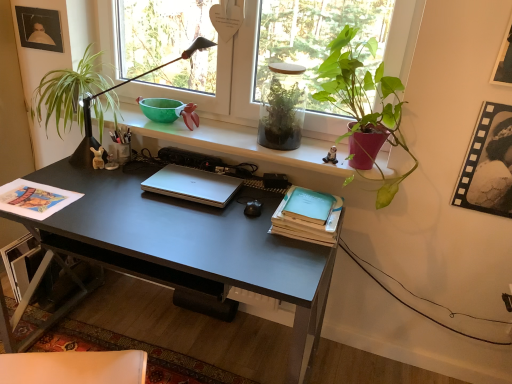
What are the coordinates of `vacant space in front of light blue matte paper at center right, the second paperback book when ordered from top to bottom` in the screenshot? It's located at (283, 258).